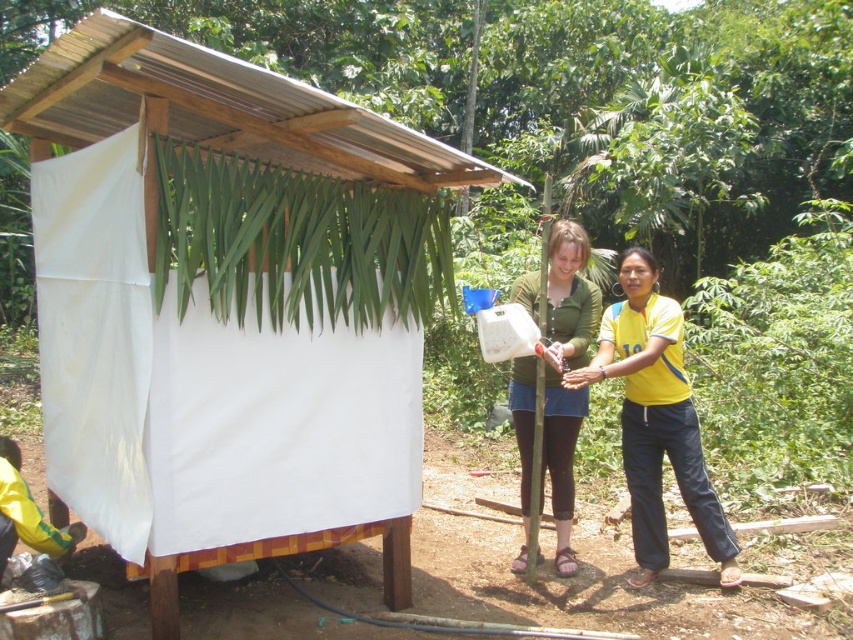
Question: Is yellow fabric pants at center above green matte shirt at center?

Choices:
 (A) yes
 (B) no

Answer: (B)

Question: Estimate the real-world distances between objects in this image. Which object is farther from the white fabric shelter at center?

Choices:
 (A) green matte shirt at center
 (B) yellow fabric pants at center

Answer: (B)

Question: Estimate the real-world distances between objects in this image. Which object is closer to the green matte shirt at center?

Choices:
 (A) white fabric shelter at center
 (B) yellow fabric pants at center

Answer: (B)

Question: Is white fabric shelter at center smaller than green matte shirt at center?

Choices:
 (A) yes
 (B) no

Answer: (B)

Question: Is white fabric shelter at center smaller than green matte shirt at center?

Choices:
 (A) no
 (B) yes

Answer: (A)

Question: Among these points, which one is nearest to the camera?

Choices:
 (A) (438, 145)
 (B) (628, 312)
 (C) (581, 355)

Answer: (A)